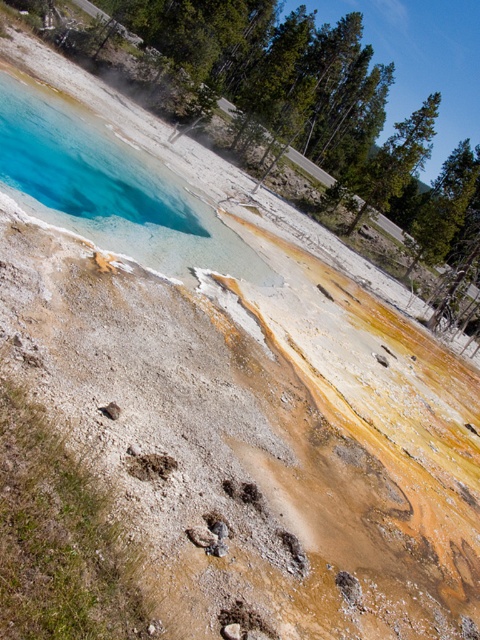
Is blue translucent pool at upper left thinner than brown sandy footprint at lower center?

In fact, blue translucent pool at upper left might be wider than brown sandy footprint at lower center.

Which of these two, blue translucent pool at upper left or brown sandy footprint at lower center, stands shorter?

brown sandy footprint at lower center is shorter.

Image resolution: width=480 pixels, height=640 pixels. What are the coordinates of `blue translucent pool at upper left` in the screenshot? It's located at (110, 189).

Locate an element on the screen. The width and height of the screenshot is (480, 640). blue translucent pool at upper left is located at coordinates (110, 189).